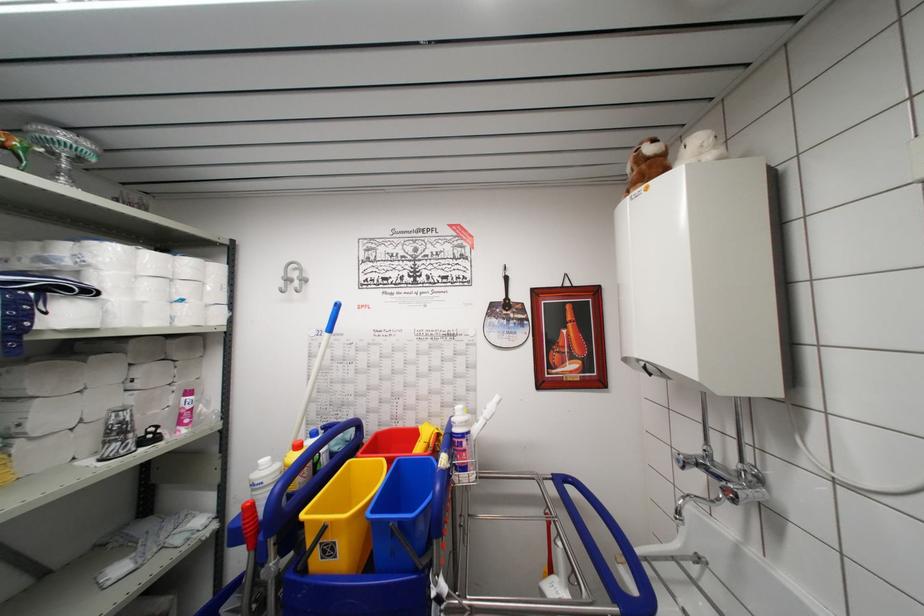
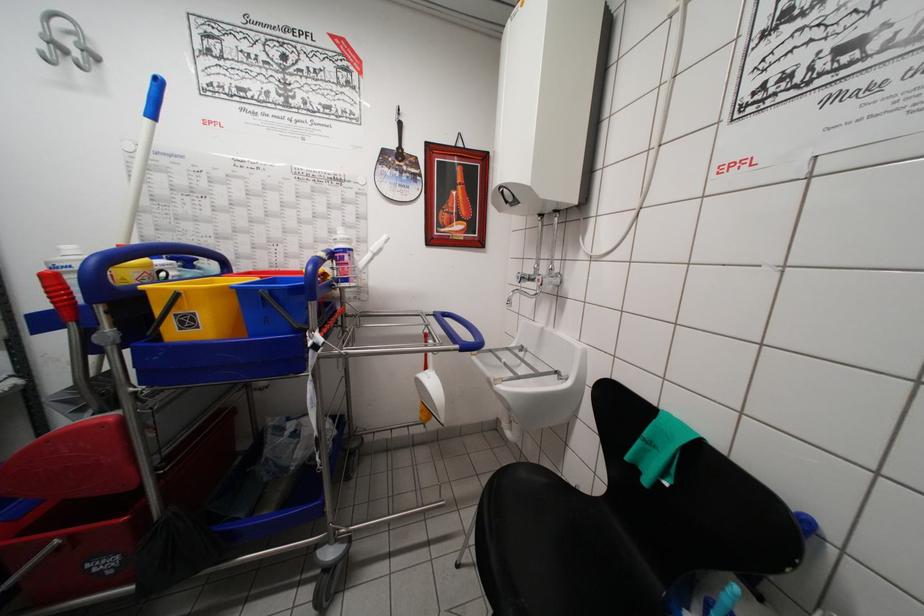
Find the pixel in the second image that matches point 682,464 in the first image.

(521, 282)